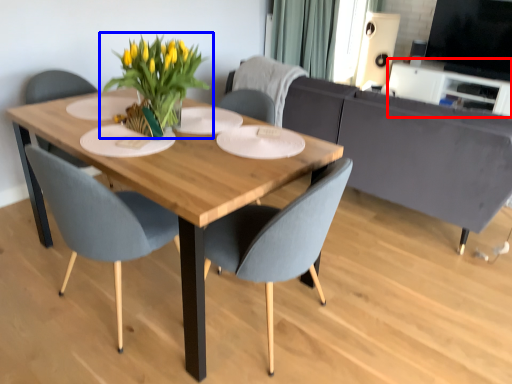
Question: Which point is closer to the camera, entertainment center (highlighted by a red box) or houseplant (highlighted by a blue box)?

Choices:
 (A) entertainment center
 (B) houseplant

Answer: (B)